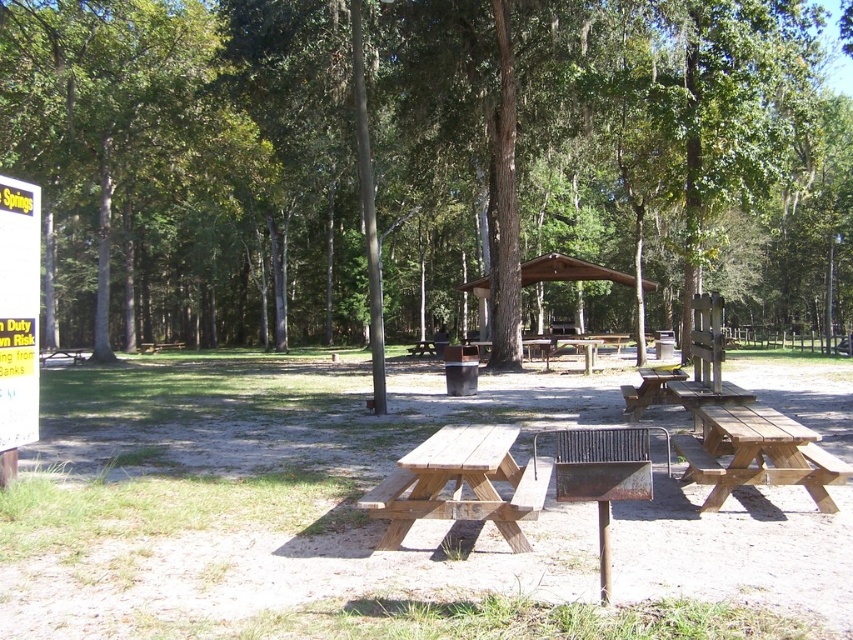
You are sitting at the picnic table and looking towards the trees. Which tree, the brown wood tree at center or the green leafy tree at left, is positioned higher in your field of view?

The brown wood tree at center is positioned higher in the field of view than the green leafy tree at left.

You are planning to hang a hammock between the brown wood tree at center and the light brown wooden picnic table at center. Considering their heights, which object would be the better anchor point for the hammock?

The brown wood tree at center is taller than the light brown wooden picnic table at center, so it would be the better anchor point for the hammock due to its greater height.